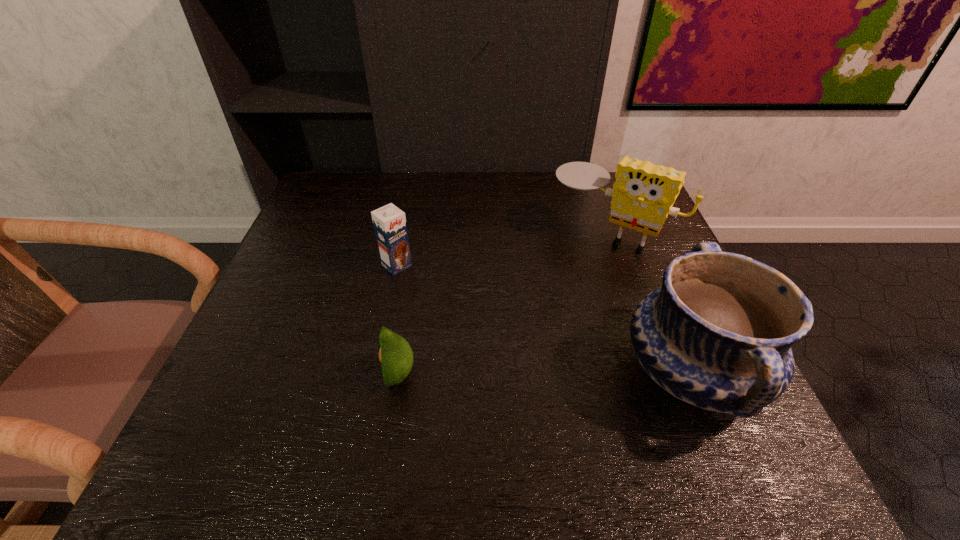
Find the location of a particular element. This screenshot has height=540, width=960. free space between the shortest object and the pottery is located at coordinates (545, 374).

Locate an element on the screen. This screenshot has height=540, width=960. unoccupied area between the avocado and the pottery is located at coordinates (545, 374).

The height and width of the screenshot is (540, 960). Identify the location of free space between the sponge and the shortest object. (504, 304).

What are the coordinates of `free spot between the avocado and the pottery` in the screenshot? It's located at [x=545, y=374].

The image size is (960, 540). What are the coordinates of `object that stands as the second closest to the chocolate milk` in the screenshot? It's located at (643, 194).

Locate which object ranks second in proximity to the pottery. Please provide its 2D coordinates. Your answer should be formatted as a tuple, i.e. [(x, y)], where the tuple contains the x and y coordinates of a point satisfying the conditions above.

[(395, 354)]

Locate an element on the screen. blank area in the image that satisfies the following two spatial constraints: 1. on the front side of the sponge; 2. on the left side of the pottery is located at coordinates (657, 373).

This screenshot has width=960, height=540. I want to click on free point that satisfies the following two spatial constraints: 1. on the front side of the shortest object; 2. on the cut side of the chocolate milk, so click(x=373, y=374).